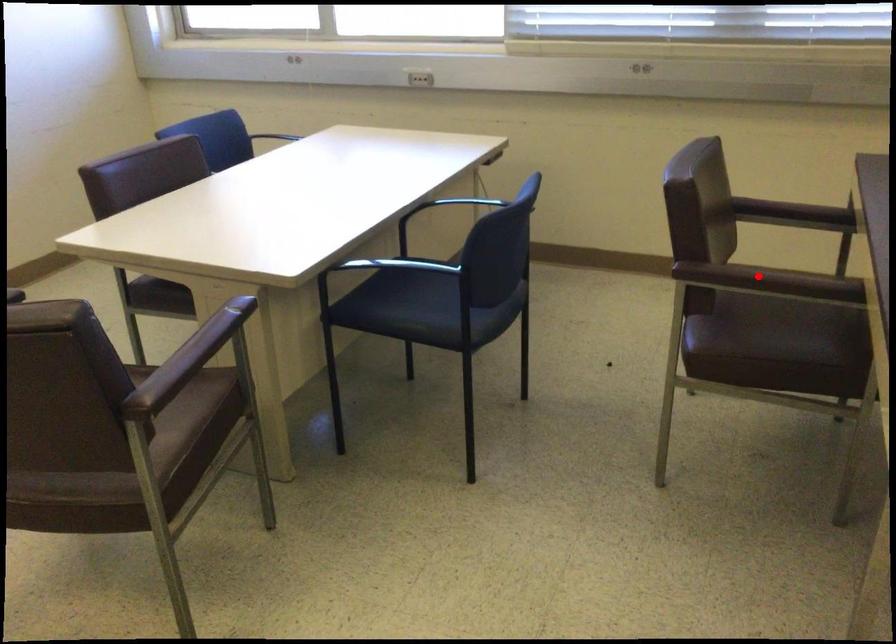
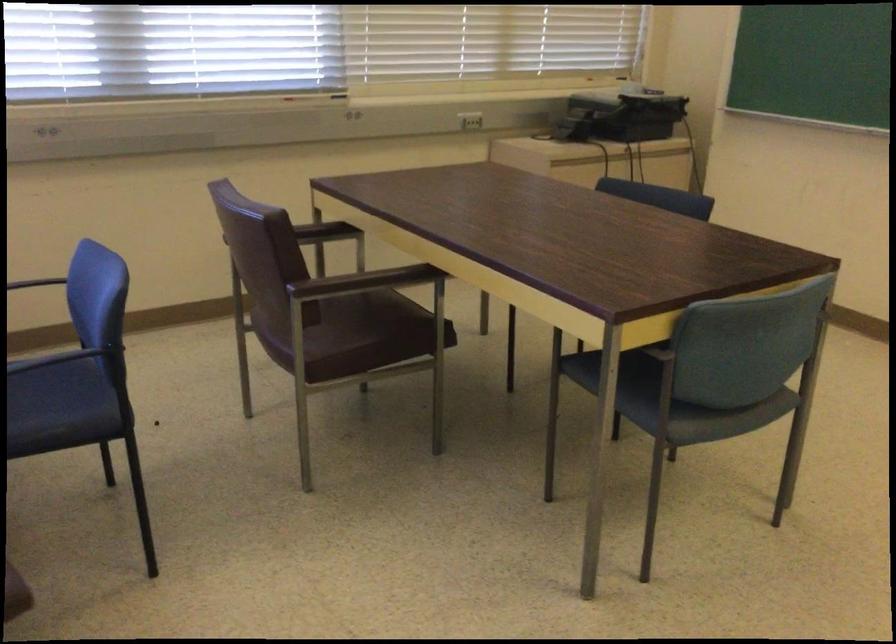
Question: I am providing you with two images of the same scene from different viewpoints. Given a red point in image1, look at the same physical point in image2. Is it:

Choices:
 (A) Closer to the viewpoint
 (B) Farther from the viewpoint

Answer: (B)